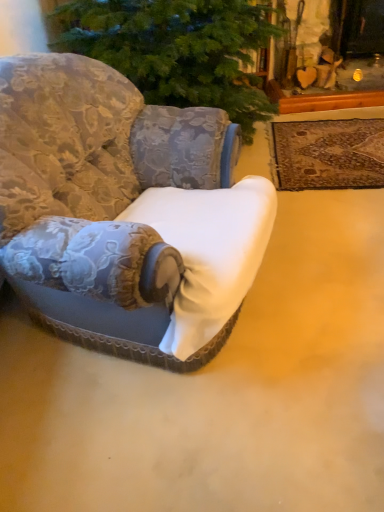
Question: Considering the positions of brown woven rug at upper right and white fabric chair at center in the image, is brown woven rug at upper right bigger or smaller than white fabric chair at center?

Choices:
 (A) big
 (B) small

Answer: (B)

Question: In the image, is brown woven rug at upper right positioned in front of or behind white fabric chair at center?

Choices:
 (A) front
 (B) behind

Answer: (B)

Question: Choose the correct answer: Is brown woven rug at upper right inside white fabric chair at center or outside it?

Choices:
 (A) inside
 (B) outside

Answer: (B)

Question: From the image's perspective, is white fabric chair at center located above or below brown woven rug at upper right?

Choices:
 (A) above
 (B) below

Answer: (B)

Question: From a real-world perspective, is white fabric chair at center physically located above or below brown woven rug at upper right?

Choices:
 (A) above
 (B) below

Answer: (A)

Question: Is white fabric chair at center spatially inside brown woven rug at upper right, or outside of it?

Choices:
 (A) inside
 (B) outside

Answer: (B)

Question: Considering the positions of white fabric chair at center and brown woven rug at upper right in the image, is white fabric chair at center taller or shorter than brown woven rug at upper right?

Choices:
 (A) tall
 (B) short

Answer: (A)